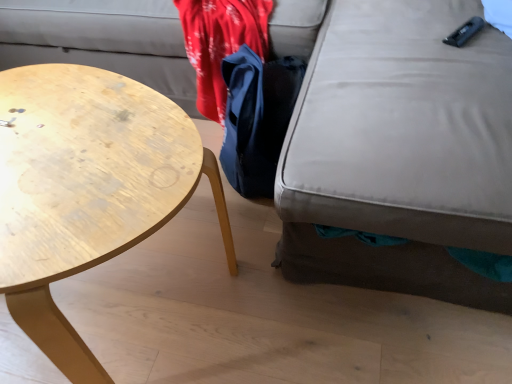
You are a GUI agent. You are given a task and a screenshot of the screen. Output one action in this format:
    pyautogui.click(x=<x>, y=<y>)
    Task: Click on the blank space above wooden coffee table at left (from a real-world perspective)
    
    Given the screenshot: What is the action you would take?
    pyautogui.click(x=71, y=149)